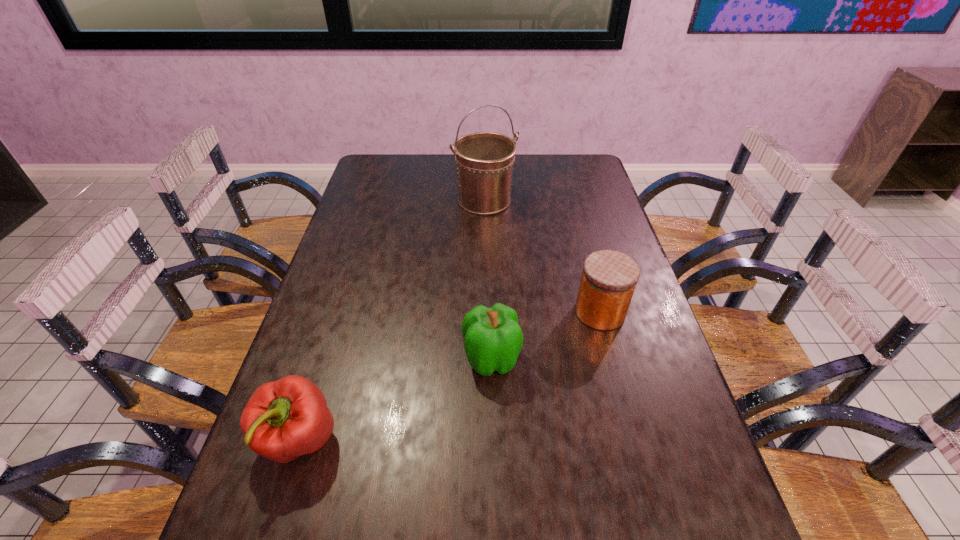
At what (x,y) coordinates should I click in order to perform the action: click on vacant area situated on the front of the jar. Please return your answer as a coordinate pair (x, y). This screenshot has width=960, height=540. Looking at the image, I should click on (626, 409).

Identify the location of vacant space located 0.190m on the back of the left bell pepper. Image resolution: width=960 pixels, height=540 pixels. (331, 337).

Find the location of a particular element. Image resolution: width=960 pixels, height=540 pixels. object at the far edge is located at coordinates (484, 160).

At what (x,y) coordinates should I click in order to perform the action: click on object at the left edge. Please return your answer as a coordinate pair (x, y). Image resolution: width=960 pixels, height=540 pixels. Looking at the image, I should click on (x=284, y=419).

Where is `object at the right edge`? object at the right edge is located at coordinates (609, 278).

Identify the location of free space at the left edge of the desktop. This screenshot has width=960, height=540. (390, 190).

Identify the location of vacant area at the right edge. This screenshot has width=960, height=540. (575, 219).

Identify the location of free space at the far left corner of the desktop. (390, 155).

Locate an element on the screen. free area in between the rightmost object and the farthest object is located at coordinates (542, 256).

Where is `blank region between the left bell pepper and the third nearest object`? blank region between the left bell pepper and the third nearest object is located at coordinates (449, 376).